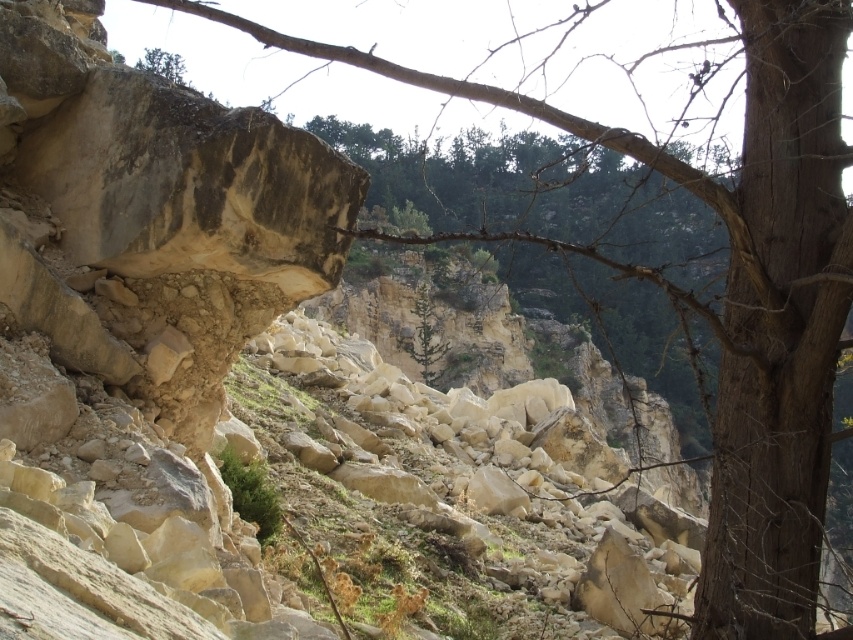
Does smooth beige rock at center have a lesser height compared to green matte tree at center?

Incorrect, smooth beige rock at center's height does not fall short of green matte tree at center's.

The width and height of the screenshot is (853, 640). What do you see at coordinates (138, 323) in the screenshot? I see `smooth beige rock at center` at bounding box center [138, 323].

Does point (218, 160) come closer to viewer compared to point (424, 368)?

Yes, point (218, 160) is closer to viewer.

The image size is (853, 640). Identify the location of smooth beige rock at center. (138, 323).